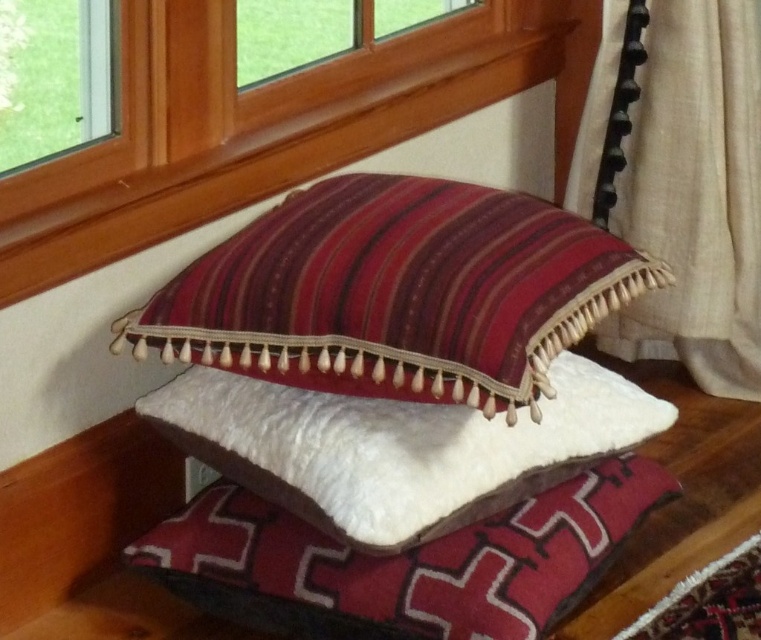
Question: Which of the following is the farthest from the observer?

Choices:
 (A) white soft pillow at center
 (B) wooden frame at upper center

Answer: (B)

Question: Estimate the real-world distances between objects in this image. Which object is farther from the beige fabric curtain at right?

Choices:
 (A) striped velvet cushion at center
 (B) wooden frame at upper center

Answer: (A)

Question: Which object is the closest to the velvet textured pillow at center?

Choices:
 (A) white soft pillow at center
 (B) striped velvet cushion at center
 (C) wooden frame at upper center

Answer: (A)

Question: Does velvet textured pillow at center appear over beige fabric curtain at right?

Choices:
 (A) no
 (B) yes

Answer: (A)

Question: Is the position of striped velvet cushion at center less distant than that of wooden frame at upper center?

Choices:
 (A) yes
 (B) no

Answer: (A)

Question: Can you confirm if wooden frame at upper center is smaller than beige fabric curtain at right?

Choices:
 (A) yes
 (B) no

Answer: (B)